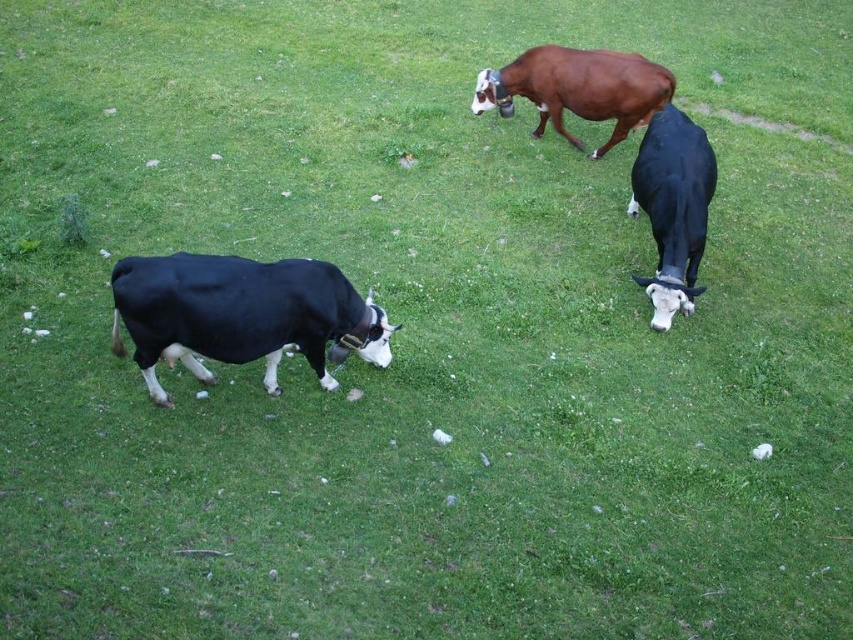
Which is above, black glossy cow at right or brown glossy cow at upper center?

brown glossy cow at upper center is higher up.

Who is positioned more to the right, black glossy cow at right or brown glossy cow at upper center?

From the viewer's perspective, black glossy cow at right appears more on the right side.

At what (x,y) coordinates should I click in order to perform the action: click on black glossy cow at right. Please return your answer as a coordinate pair (x, y). Looking at the image, I should click on (672, 208).

Locate an element on the screen. Image resolution: width=853 pixels, height=640 pixels. black glossy cow at right is located at coordinates (672, 208).

Is black smooth cow at left thinner than black glossy cow at right?

No.

Can you confirm if black smooth cow at left is positioned to the left of black glossy cow at right?

Indeed, black smooth cow at left is positioned on the left side of black glossy cow at right.

Is point (125, 310) positioned before point (705, 234)?

Yes.

Where is `black smooth cow at left`? The width and height of the screenshot is (853, 640). black smooth cow at left is located at coordinates 241,314.

Identify the location of black smooth cow at left. (241, 314).

Is point (158, 384) farther from camera compared to point (495, 83)?

No, it is not.

Which is in front, point (160, 307) or point (573, 92)?

Point (160, 307)

Find the location of a particular element. This screenshot has width=853, height=640. black smooth cow at left is located at coordinates (241, 314).